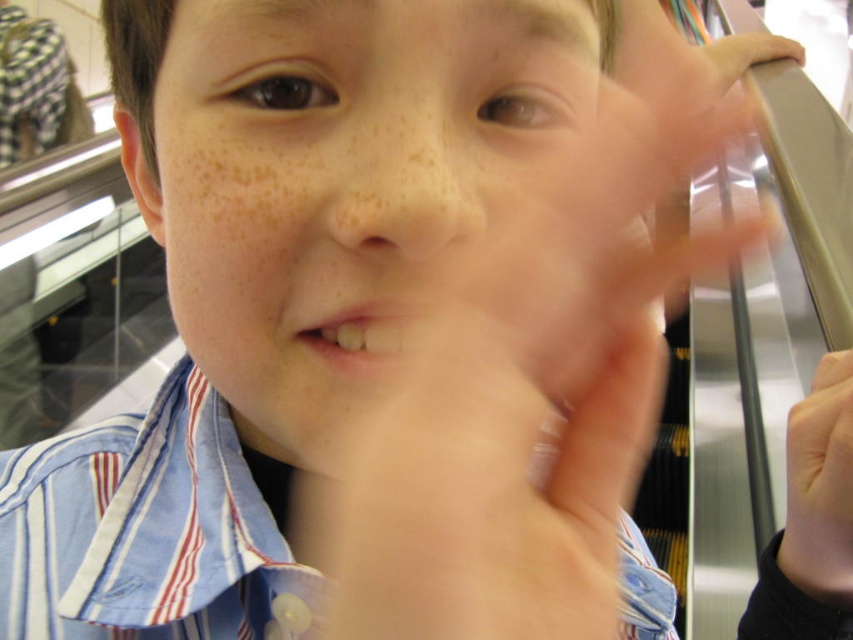
You are a photographer standing 50 centimeters away from the blue striped shirt at center. You want to take a closeup photo of the shirt but need to be exactly 30.95 centimeters away. Should you move closer or farther away?

The blue striped shirt at center and viewer are 30.95 centimeters apart. Since you are currently 50 centimeters away, you should move closer to reach the required distance of 30.95 centimeters.

You are a photographer trying to capture the perfect shot of the blue striped shirt at center and the smooth skin hand at lower right. To ensure both are in focus, you need to know their vertical positions. Which object is positioned lower in the image?

The blue striped shirt at center is positioned below the smooth skin hand at lower right, so the blue striped shirt at center is lower in the image.

In the scene shown: Based on the scene description, can you determine if the smooth skin face at center is taller than the smooth skin hand at lower right?

The smooth skin face at center is much taller than the smooth skin hand at lower right according to the description.